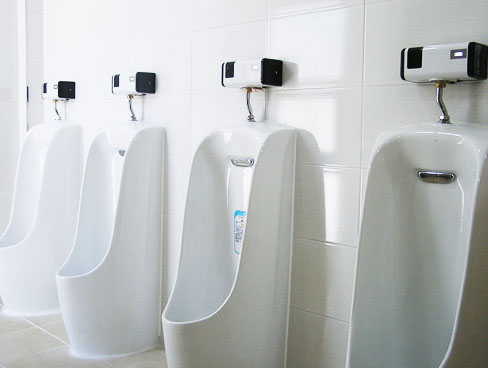
The image size is (488, 368). I want to click on auto flush sensors, so click(x=56, y=90), click(x=135, y=81), click(x=245, y=72), click(x=422, y=59).